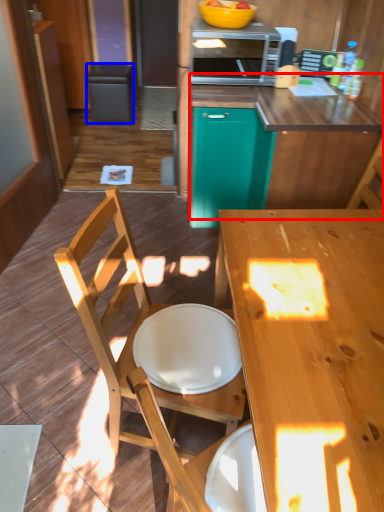
Question: Which object appears closest to the camera in this image, counter (highlighted by a red box) or trash bin/can (highlighted by a blue box)?

Choices:
 (A) counter
 (B) trash bin/can

Answer: (A)